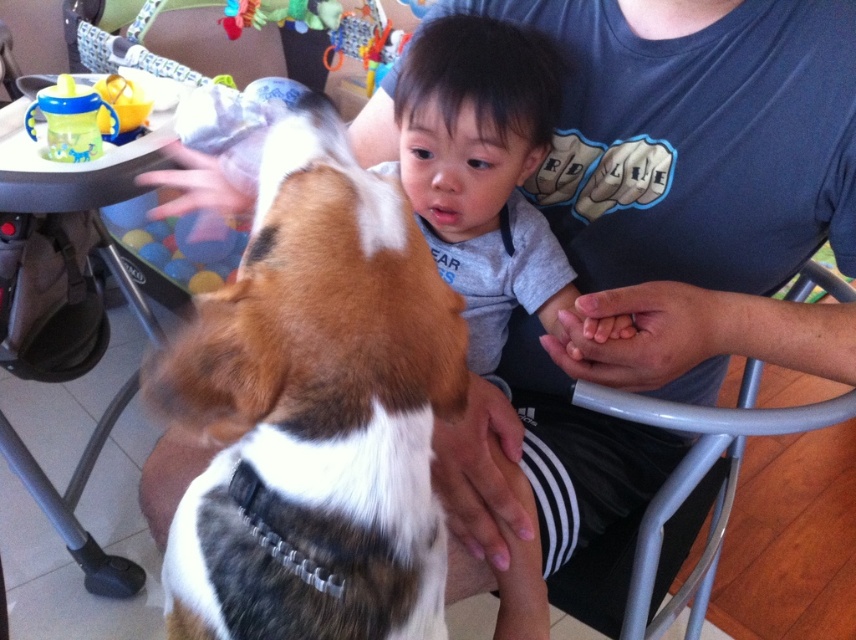
Question: Does brown and white fur at center appear over translucent plastic sippy cup at upper left?

Choices:
 (A) no
 (B) yes

Answer: (A)

Question: Is brown and white fur at center positioned at the back of translucent plastic sippy cup at upper left?

Choices:
 (A) no
 (B) yes

Answer: (A)

Question: Which of the following is the farthest from the observer?

Choices:
 (A) (70, 108)
 (B) (376, 177)

Answer: (A)

Question: Does brown and white fur at center appear under translucent plastic sippy cup at upper left?

Choices:
 (A) yes
 (B) no

Answer: (A)

Question: Which is farther from the brown and white fur at center?

Choices:
 (A) gray plastic chair at center
 (B) translucent plastic sippy cup at upper left

Answer: (B)

Question: Estimate the real-world distances between objects in this image. Which object is closer to the brown and white fur at center?

Choices:
 (A) gray plastic chair at center
 (B) translucent plastic sippy cup at upper left

Answer: (A)